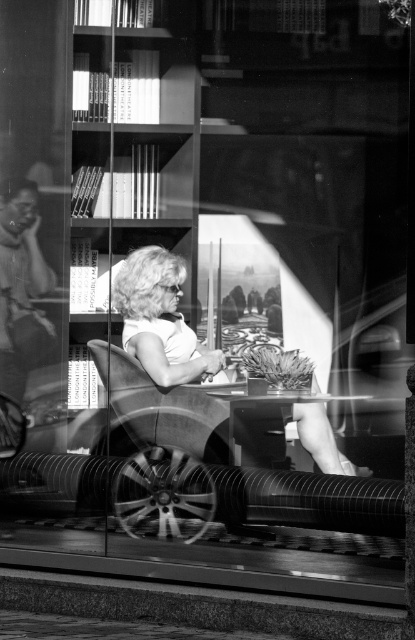
You are planning to sit down in the scene described. You have a large backpack with you. Which object would be more suitable for placing your backpack next to without it falling over? Please choose between the smooth wood park bench at center and the white fabric chair at center.

The smooth wood park bench at center is more suitable for placing your backpack next to because it is wider than the white fabric chair at center, providing a more stable and level surface.